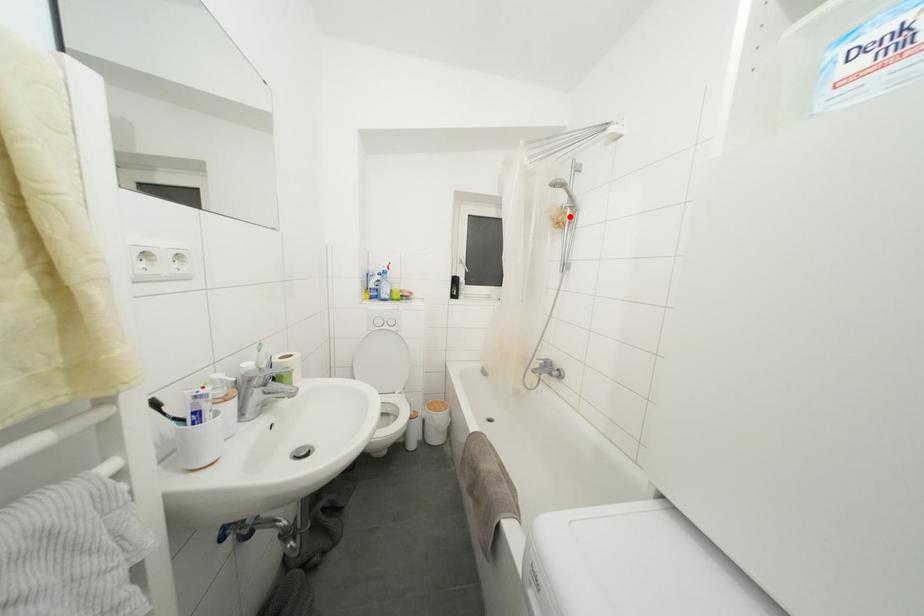
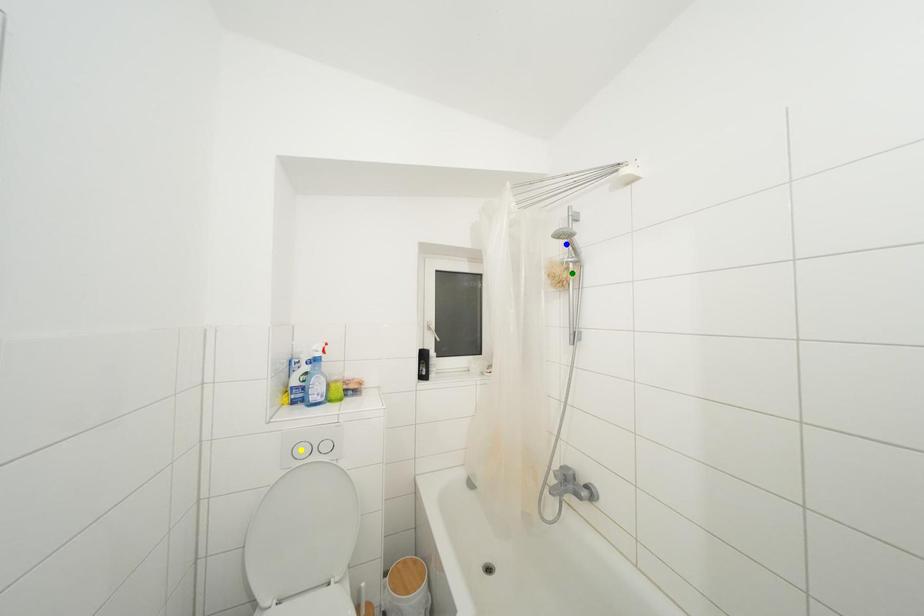
Question: I am providing you with two images of the same scene from different viewpoints. A red point is marked on the first image. You are given multiple points on the second image. Which point in image 2 represents the same 3d spot as the red point in image 1?

Choices:
 (A) blue point
 (B) yellow point
 (C) green point

Answer: (C)